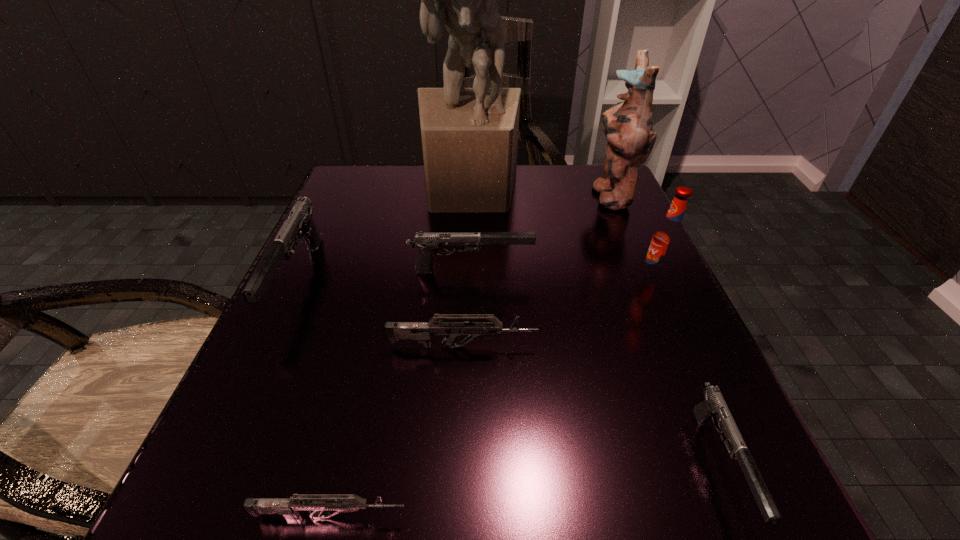
Identify the location of free point that satisfies the following two spatial constraints: 1. on the front-facing side of the gray sculpture; 2. aimed along the barrel of the shortest object. This screenshot has height=540, width=960. click(x=458, y=516).

At what (x,y) coordinates should I click in order to perform the action: click on vacant space that satisfies the following two spatial constraints: 1. at the muzzle end of the root beer; 2. on the right side of the second smallest gray gun. Please return your answer as a coordinate pair (x, y). The image size is (960, 540). Looking at the image, I should click on (470, 279).

Find the location of a particular element. This screenshot has height=540, width=960. free location that satisfies the following two spatial constraints: 1. on the front side of the red root beer; 2. aimed along the barrel of the nearer grey gun is located at coordinates (763, 516).

The height and width of the screenshot is (540, 960). In order to click on free point that satisfies the following two spatial constraints: 1. at the muzzle end of the root beer; 2. on the left side of the second biggest gray gun in this screenshot , I will do `click(470, 279)`.